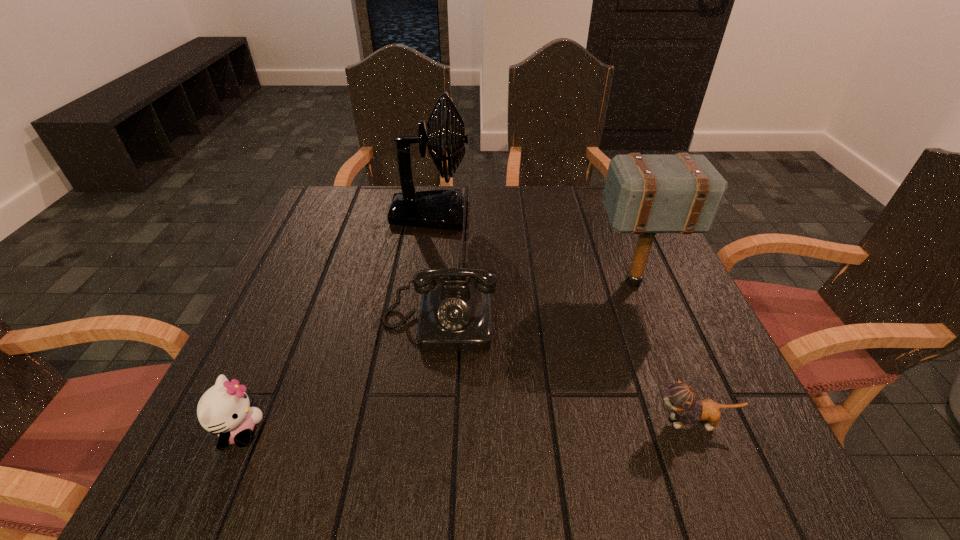
At what (x,y) coordinates should I click in order to perform the action: click on vacant space that satisfies the following two spatial constraints: 1. on the striking surface of the mallet; 2. on the dial of the telephone. Please return your answer as a coordinate pair (x, y). The image size is (960, 540). Looking at the image, I should click on (651, 323).

This screenshot has width=960, height=540. Identify the location of vacant space that satisfies the following two spatial constraints: 1. on the dial of the telephone; 2. on the front-facing side of the left kitten. (429, 431).